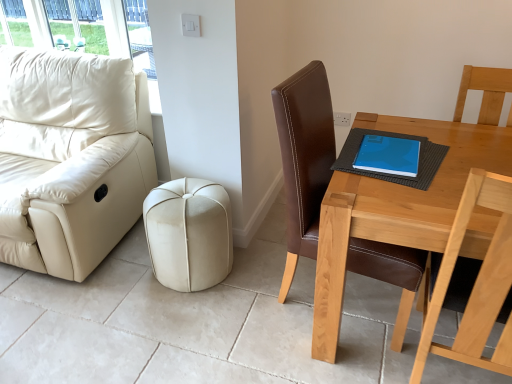
Where is `free location in front of beige leather ottoman at center`? free location in front of beige leather ottoman at center is located at coordinates (157, 324).